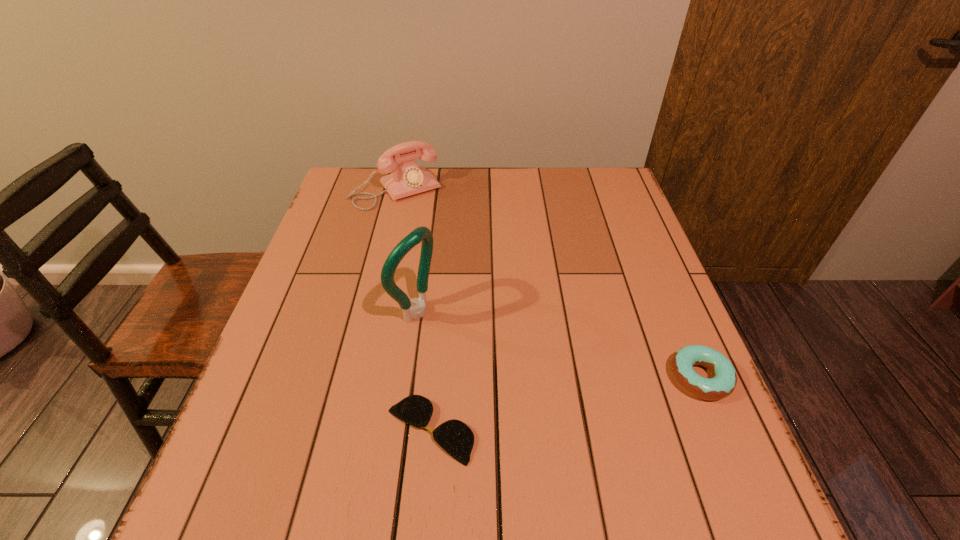
The height and width of the screenshot is (540, 960). What are the coordinates of `free space on the desktop that is between the shortest object and the doughnut and is positioned at the jaws of the tallest object` in the screenshot? It's located at (587, 400).

This screenshot has width=960, height=540. In order to click on free space on the desktop that is between the shortest object and the doughnut and is positioned on the dial of the third shortest object in this screenshot , I will do `click(554, 406)`.